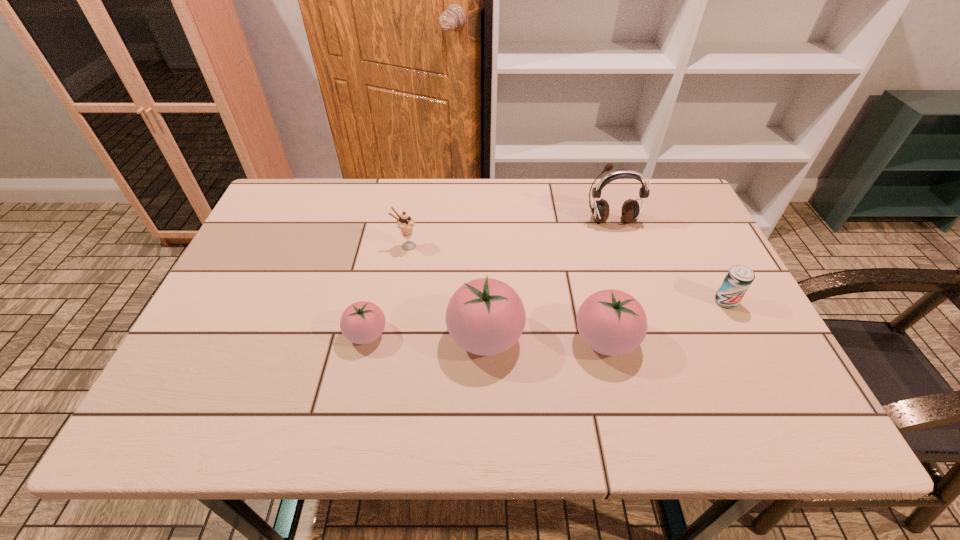
The image size is (960, 540). Find the location of `vacant space at the near left corner of the desktop`. vacant space at the near left corner of the desktop is located at coordinates (188, 366).

The width and height of the screenshot is (960, 540). Identify the location of free spot between the farthest object and the second farthest object. pos(509,233).

Identify the location of free area in between the fourth object from right to left and the icecream. (445, 291).

This screenshot has height=540, width=960. Find the location of `free spot between the icecream and the rightmost object`. free spot between the icecream and the rightmost object is located at coordinates (566, 274).

The width and height of the screenshot is (960, 540). Find the location of `unoccupied area between the shortest object and the fifth nearest object`. unoccupied area between the shortest object and the fifth nearest object is located at coordinates 386,290.

At what (x,y) coordinates should I click in order to perform the action: click on vacant space that is in between the rightmost object and the earphone. Please return your answer as a coordinate pair (x, y). The height and width of the screenshot is (540, 960). Looking at the image, I should click on [x=668, y=261].

This screenshot has height=540, width=960. What are the coordinates of `free space that is in between the third object from left to right and the tallest object` in the screenshot? It's located at (548, 279).

Identify the location of free space between the leftmost tomato and the third object from left to right. (426, 335).

The width and height of the screenshot is (960, 540). Identify the location of vacant region between the fourth object from right to left and the shortest tomato. (426, 335).

At what (x,y) coordinates should I click in order to perform the action: click on vacant point located between the farthest object and the rightmost object. Please return your answer as a coordinate pair (x, y). This screenshot has width=960, height=540. Looking at the image, I should click on (668, 261).